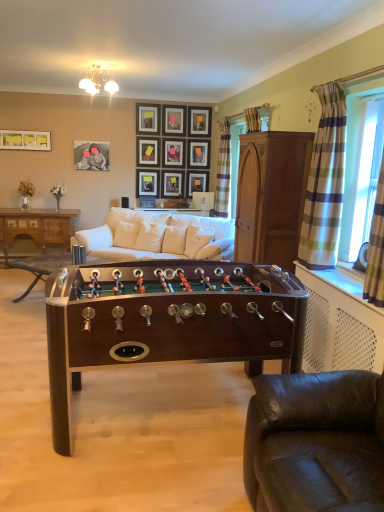
Question: Could you tell me if white fabric couch at center, the 1th studio couch positioned from the back, is facing plaid fabric curtain at right, placed as the second curtain when sorted from left to right?

Choices:
 (A) no
 (B) yes

Answer: (A)

Question: Is white fabric couch at center, arranged as the 1th studio couch when viewed from the top, smaller than plaid fabric curtain at right, placed as the second curtain when sorted from left to right?

Choices:
 (A) yes
 (B) no

Answer: (B)

Question: Does white fabric couch at center, arranged as the 2th studio couch when ordered from the bottom, come in front of plaid fabric curtain at right, placed as the second curtain when sorted from left to right?

Choices:
 (A) yes
 (B) no

Answer: (B)

Question: Is white fabric couch at center, the 1th studio couch positioned from the back, further to camera compared to plaid fabric curtain at right, which appears as the 1th curtain when viewed from the right?

Choices:
 (A) yes
 (B) no

Answer: (A)

Question: Would you say white fabric couch at center, the 1th studio couch positioned from the back, is outside plaid fabric curtain at right, placed as the second curtain when sorted from left to right?

Choices:
 (A) no
 (B) yes

Answer: (B)

Question: From a real-world perspective, is white fabric couch at center, arranged as the 2th studio couch when ordered from the bottom, located beneath plaid fabric curtain at right, arranged as the 1th curtain when viewed from the front?

Choices:
 (A) no
 (B) yes

Answer: (B)

Question: Can you confirm if mahogany wood foosball table at center, the 3th table when ordered from back to front, is bigger than white fabric pillow at center, which is the third pillow in left-to-right order?

Choices:
 (A) yes
 (B) no

Answer: (A)

Question: Can you confirm if mahogany wood foosball table at center, which is the 3th table from left to right, is positioned to the right of white fabric pillow at center, placed as the first pillow when sorted from right to left?

Choices:
 (A) no
 (B) yes

Answer: (A)

Question: Could you tell me if mahogany wood foosball table at center, which is the 3th table from left to right, is turned towards white fabric pillow at center, placed as the first pillow when sorted from right to left?

Choices:
 (A) no
 (B) yes

Answer: (A)

Question: Is the depth of mahogany wood foosball table at center, the first table in the front-to-back sequence, greater than that of white fabric pillow at center, placed as the first pillow when sorted from right to left?

Choices:
 (A) no
 (B) yes

Answer: (A)

Question: Is mahogany wood foosball table at center, the first table positioned from the right, closer to camera compared to white fabric pillow at center, which is the third pillow in left-to-right order?

Choices:
 (A) yes
 (B) no

Answer: (A)

Question: Does mahogany wood foosball table at center, the first table positioned from the right, have a smaller size compared to white fabric pillow at center, placed as the first pillow when sorted from right to left?

Choices:
 (A) no
 (B) yes

Answer: (A)

Question: Does matte black picture frame at upper center, placed as the 8th picture frame when sorted from right to left, have a lesser height compared to mahogany wood foosball table at center, placed as the 2th table when sorted from front to back?

Choices:
 (A) yes
 (B) no

Answer: (A)